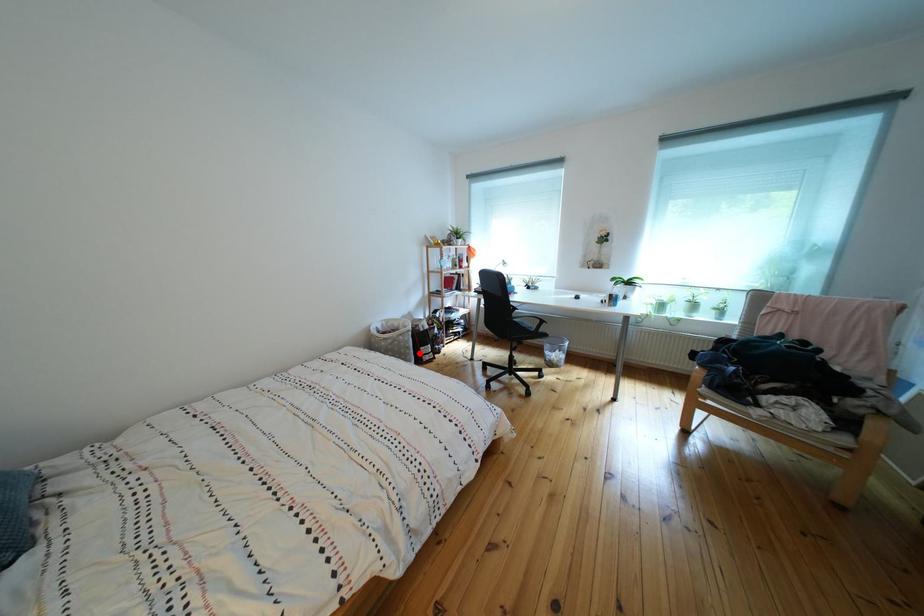
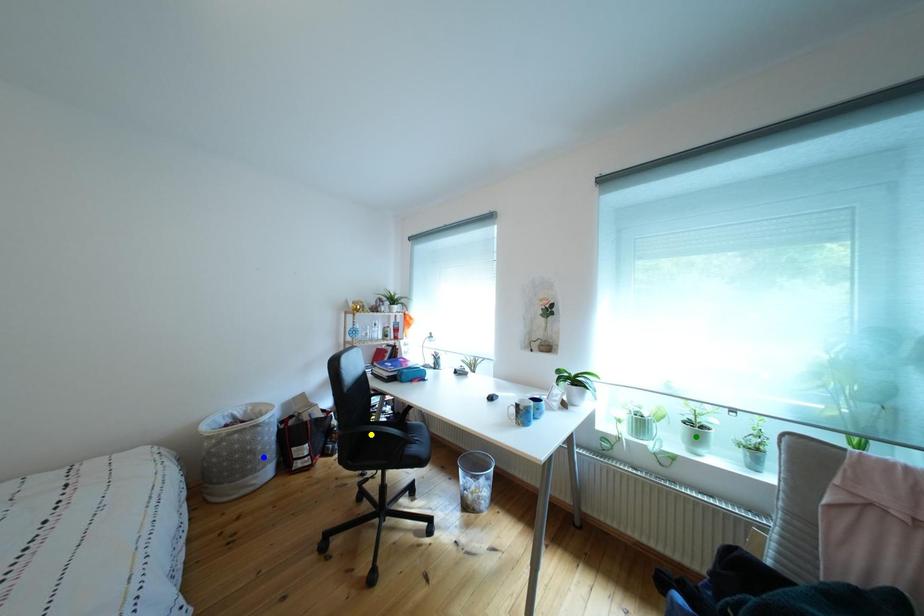
Question: I am providing you with two images of the same scene from different viewpoints. A red point is marked on the first image. You are given multiple points on the second image. In image 2, which mark is for the same physical point as the one in image 1?

Choices:
 (A) yellow point
 (B) green point
 (C) blue point

Answer: (C)